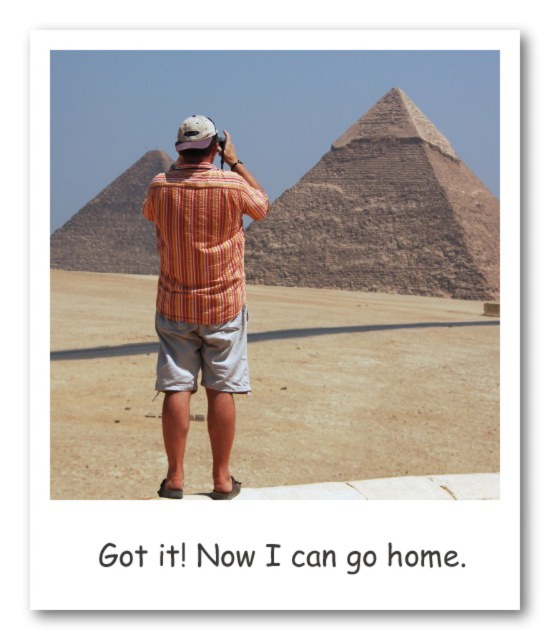
You are a tour guide explaining the pyramids to visitors. You point out the brown rough stone pyramid at center and the brown stone pyramid at left. Which one is taller?

The brown rough stone pyramid at center is taller than the brown stone pyramid at left.

You are a photographer standing in front of the Great Pyramids of Giza. You notice the brown rough stone pyramid at center and the brown stone pyramid at left. Which pyramid is positioned higher in the image?

The brown rough stone pyramid at center is positioned higher in the image than the brown stone pyramid at left.

You are a photographer trying to capture the brown rough stone pyramid at center and the orange striped shirt at center in your shot. Which object should you focus on first if you want the larger one to be sharp?

The brown rough stone pyramid at center is larger than the orange striped shirt at center, so you should focus on the brown rough stone pyramid at center first to ensure it appears sharp in the photo.